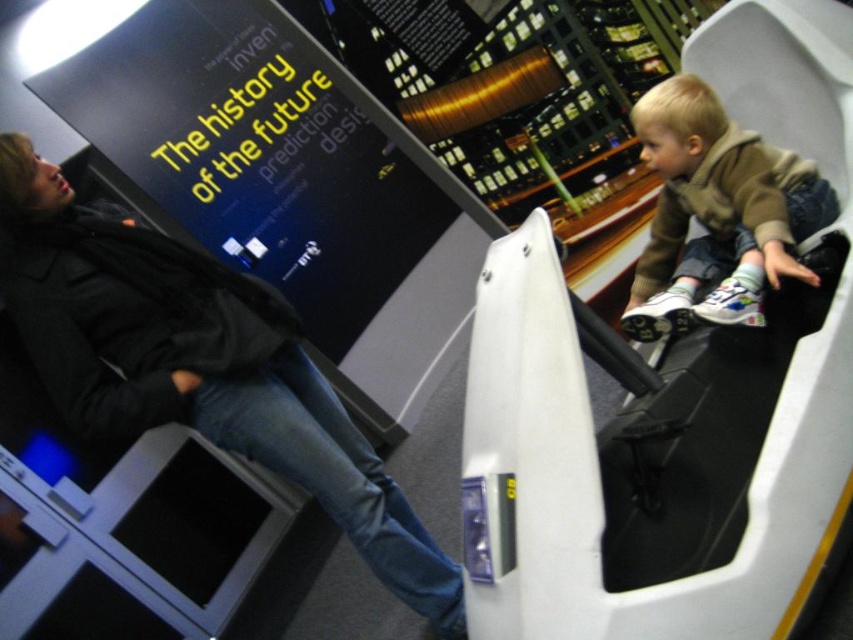
Measure the distance between point (100, 308) and camera.

Point (100, 308) is 5.10 feet away from camera.

Who is lower down, dark gray jacket at upper left or light brown fleece jacket at upper right?

dark gray jacket at upper left

Where is `dark gray jacket at upper left`? The height and width of the screenshot is (640, 853). dark gray jacket at upper left is located at coordinates (196, 365).